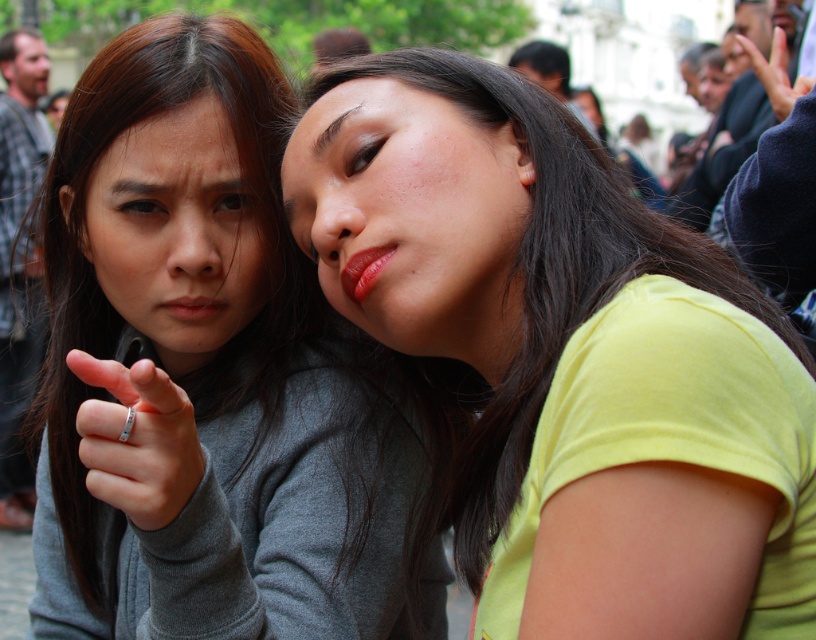
Which is more to the left, yellow matte shirt at center or matte skin face at upper left?

From the viewer's perspective, matte skin face at upper left appears more on the left side.

Locate an element on the screen. yellow matte shirt at center is located at coordinates (528, 337).

Does matte skin face at center appear on the left side of glossy matte lips at center?

Incorrect, matte skin face at center is not on the left side of glossy matte lips at center.

Who is more forward, (512, 330) or (367, 268)?

Point (367, 268)

Image resolution: width=816 pixels, height=640 pixels. I want to click on matte skin face at center, so click(411, 218).

Between point (579, 566) and point (344, 112), which one is positioned in front?

Positioned in front is point (579, 566).

Consider the image. Is yellow matte shirt at center in front of matte skin face at center?

Yes, it is.

What are the coordinates of `yellow matte shirt at center` in the screenshot? It's located at (528, 337).

The image size is (816, 640). In order to click on yellow matte shirt at center in this screenshot , I will do `click(528, 337)`.